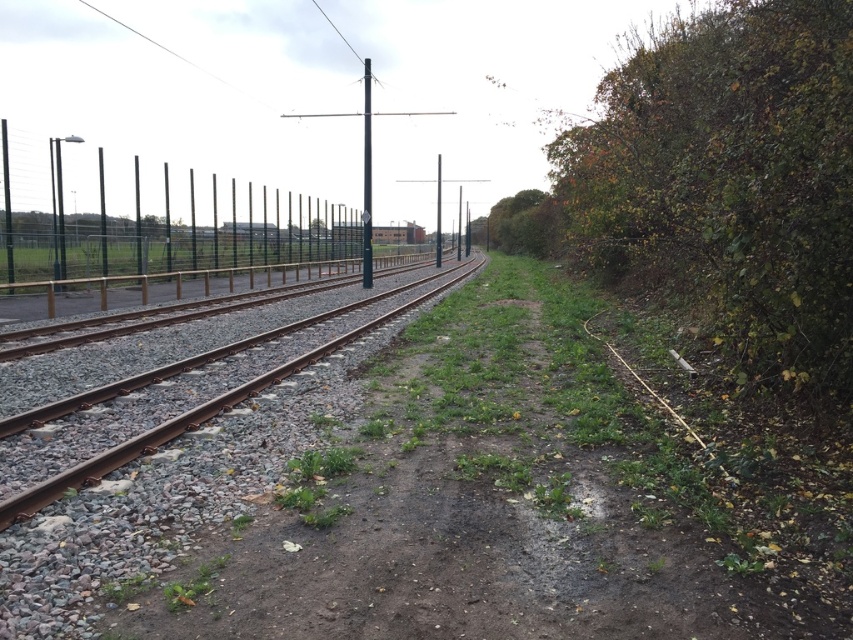
Question: Is dull brown dirt track at center closer to the viewer compared to smooth black pole at center?

Choices:
 (A) no
 (B) yes

Answer: (B)

Question: Which object is the closest to the rusty metal track at center?

Choices:
 (A) green leafy tree at upper right
 (B) black wire mesh fence at left
 (C) smooth black pole at center
 (D) dull brown dirt track at center

Answer: (D)

Question: Which is farther from the green leafy tree at upper right?

Choices:
 (A) smooth black pole at center
 (B) black wire mesh fence at left
 (C) black metal pole at center
 (D) green leafy bush at right

Answer: (D)

Question: Which point appears closest to the camera in this image?

Choices:
 (A) (521, 198)
 (B) (804, 336)
 (C) (368, 150)

Answer: (B)

Question: Does rusty metal track at center have a greater width compared to black metal pole at center?

Choices:
 (A) yes
 (B) no

Answer: (B)

Question: Does black wire mesh fence at left have a smaller size compared to black metal pole at center?

Choices:
 (A) no
 (B) yes

Answer: (B)